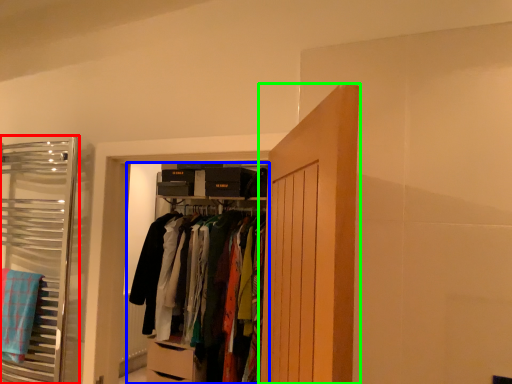
Question: Estimate the real-world distances between objects in this image. Which object is closer to closet (highlighted by a red box), closet (highlighted by a blue box) or door (highlighted by a green box)?

Choices:
 (A) closet
 (B) door

Answer: (A)